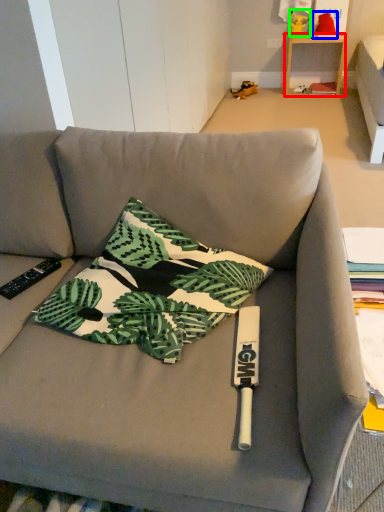
Question: Which object is the farthest from table (highlighted by a red box)? Choose among these: toy (highlighted by a blue box) or toy (highlighted by a green box).

Choices:
 (A) toy
 (B) toy

Answer: (B)